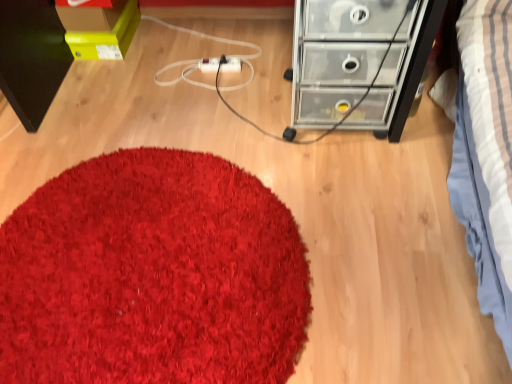
Locate an element on the screen. This screenshot has width=512, height=384. vacant area on top of shaggy red carpet at center (from a real-world perspective) is located at coordinates (106, 257).